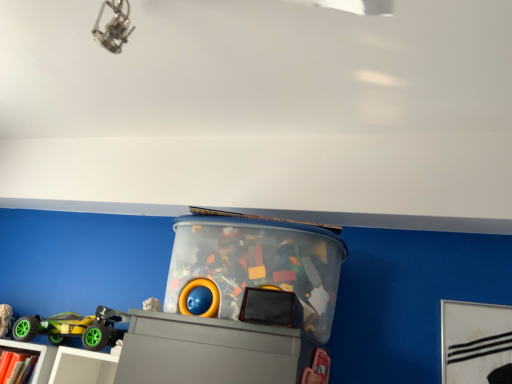
Question: Is matte gray shelf at lower left in front of or behind matte white bookcase at lower left in the image?

Choices:
 (A) behind
 (B) front

Answer: (B)

Question: In terms of size, does matte gray shelf at lower left appear bigger or smaller than matte white bookcase at lower left?

Choices:
 (A) small
 (B) big

Answer: (B)

Question: Which object is the closest to the matte gray shelf at lower left?

Choices:
 (A) green rubber toy car at lower left, which appears as the first toy when viewed from the left
 (B) matte white bookcase at lower left
 (C) transparent plastic container at center, the 1th toy when ordered from right to left

Answer: (B)

Question: Which object is the farthest from the matte white bookcase at lower left?

Choices:
 (A) transparent plastic container at center, which ranks as the 2th toy in left-to-right order
 (B) matte gray shelf at lower left
 (C) green rubber toy car at lower left, which appears as the first toy when viewed from the left

Answer: (A)